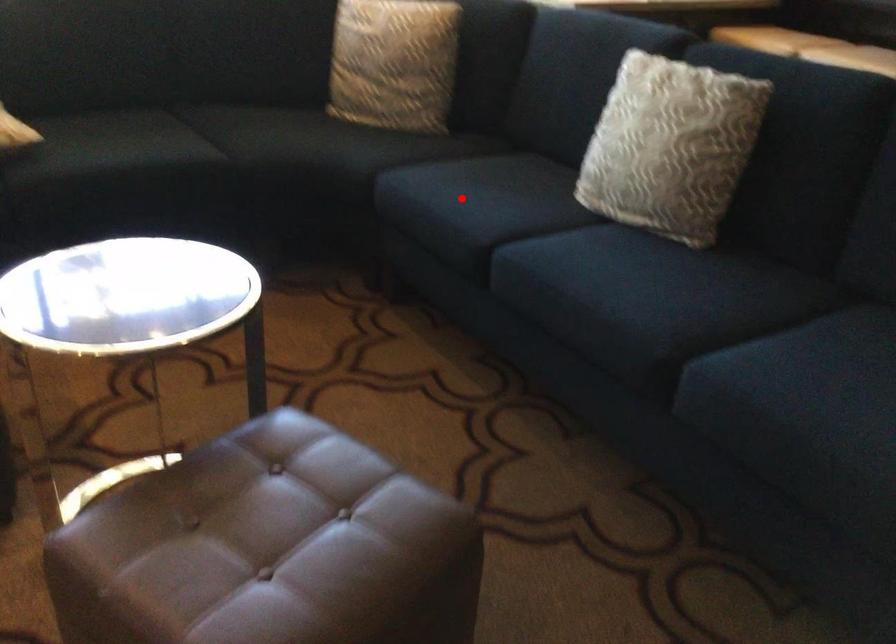
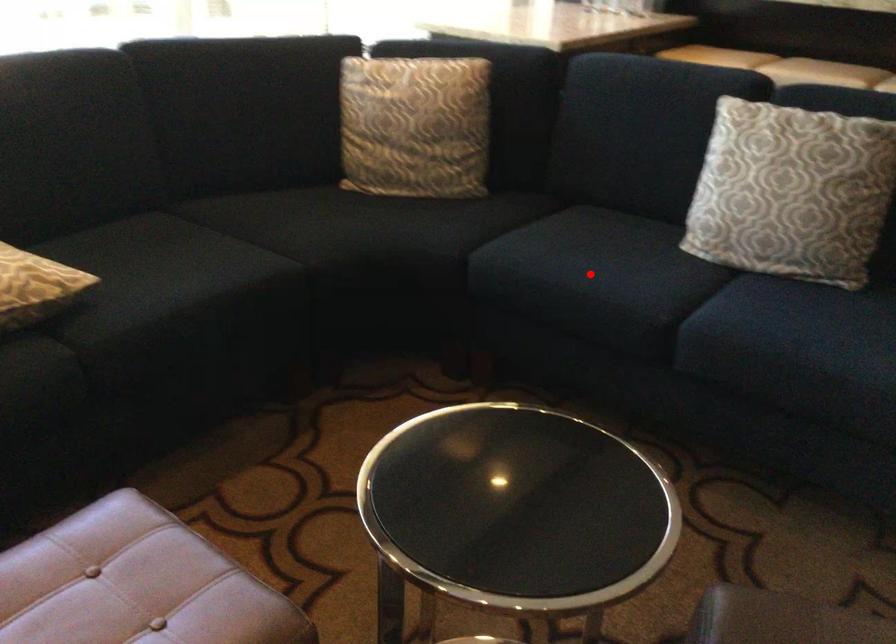
I am providing you with two images of the same scene from different viewpoints. A red point is marked on the first image and another point is marked on the second image. Does the point marked in image1 correspond to the same location as the one in image2?

Yes